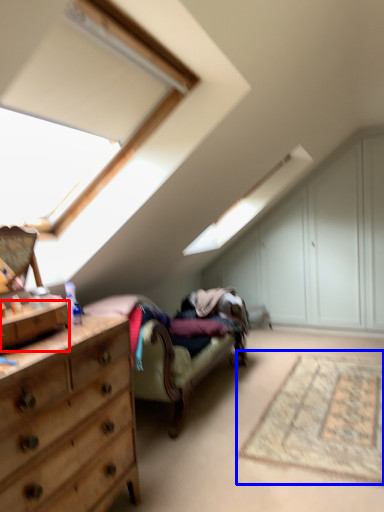
Question: Which object appears closest to the camera in this image, drawer (highlighted by a red box) or mat (highlighted by a blue box)?

Choices:
 (A) drawer
 (B) mat

Answer: (A)